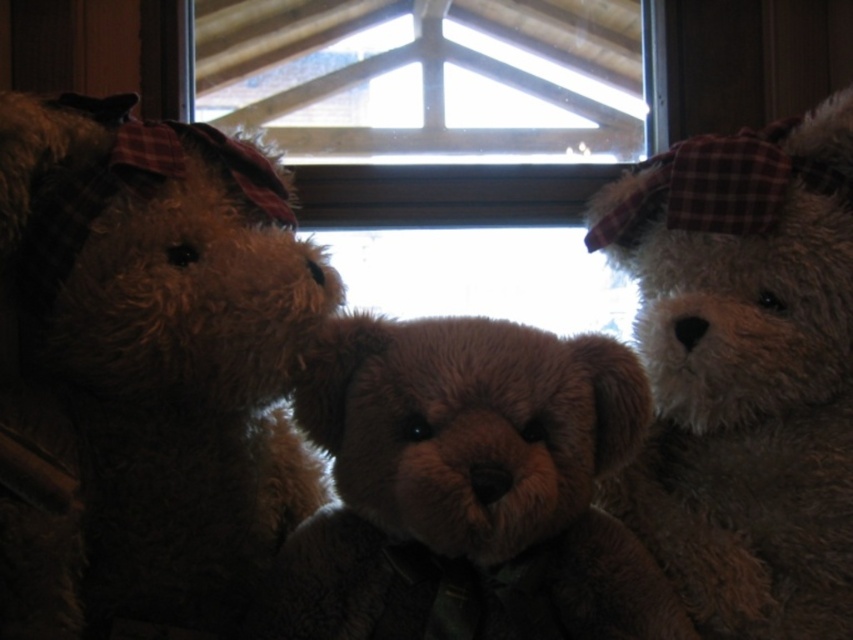
Does transparent glass window at center appear under brown plush teddy bear at center?

No.

Is point (354, 104) positioned behind point (416, 344)?

Yes, point (354, 104) is farther from viewer.

I want to click on transparent glass window at center, so click(x=442, y=140).

Between white plush bear at upper right and brown plush teddy bear at center, which one is positioned lower?

Positioned lower is brown plush teddy bear at center.

Can you confirm if white plush bear at upper right is positioned to the right of brown plush teddy bear at center?

Yes, white plush bear at upper right is to the right of brown plush teddy bear at center.

Does point (741, 577) come closer to viewer compared to point (425, 456)?

That is False.

Find the location of a particular element. The width and height of the screenshot is (853, 640). white plush bear at upper right is located at coordinates (743, 371).

Can you confirm if transparent glass window at center is taller than white plush bear at upper right?

No, transparent glass window at center is not taller than white plush bear at upper right.

Does transparent glass window at center appear on the left side of white plush bear at upper right?

Indeed, transparent glass window at center is positioned on the left side of white plush bear at upper right.

Where is `transparent glass window at center`? transparent glass window at center is located at coordinates (442, 140).